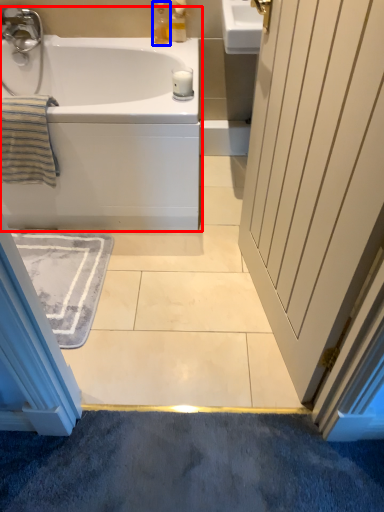
Question: Which object is further to the camera taking this photo, bathtub (highlighted by a red box) or soap dispenser (highlighted by a blue box)?

Choices:
 (A) bathtub
 (B) soap dispenser

Answer: (B)